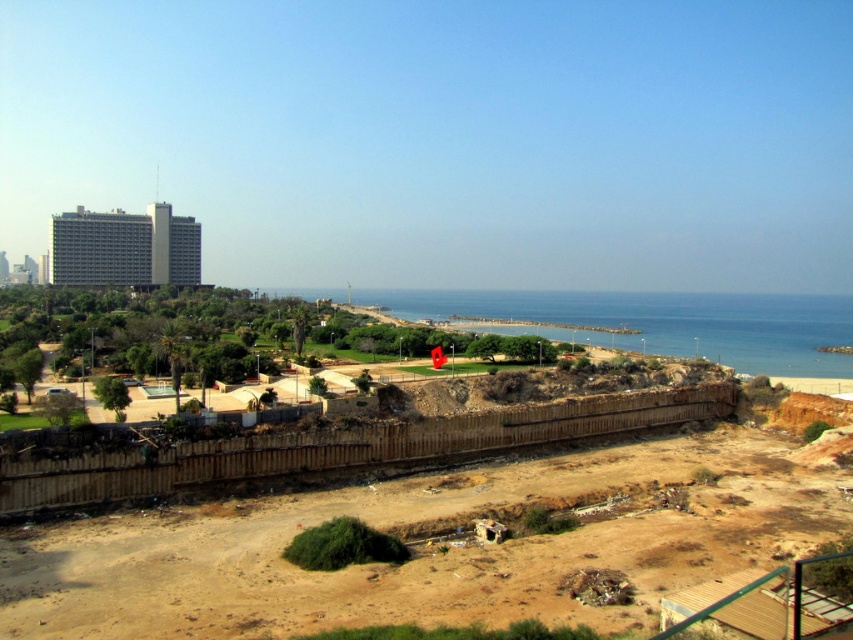
Question: Which of the following is the farthest from the observer?

Choices:
 (A) (189, 220)
 (B) (474, 326)

Answer: (A)

Question: Considering the relative positions of blue water at center and gray concrete building at upper left in the image provided, where is blue water at center located with respect to gray concrete building at upper left?

Choices:
 (A) below
 (B) above

Answer: (A)

Question: Which object is closer to the camera taking this photo?

Choices:
 (A) gray concrete building at upper left
 (B) blue water at center

Answer: (B)

Question: Which point is closer to the camera?

Choices:
 (A) blue water at center
 (B) gray concrete building at upper left

Answer: (A)

Question: Where is blue water at center located in relation to gray concrete building at upper left in the image?

Choices:
 (A) above
 (B) below

Answer: (B)

Question: Does blue water at center appear on the left side of gray concrete building at upper left?

Choices:
 (A) yes
 (B) no

Answer: (B)